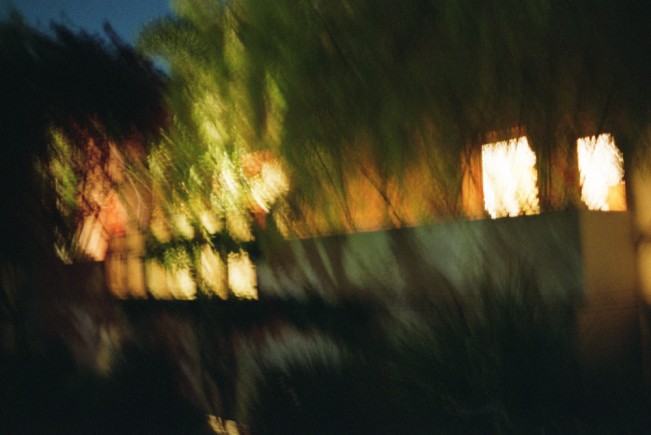
Where is `top edge of ledge`? This screenshot has width=651, height=435. top edge of ledge is located at coordinates (363, 228).